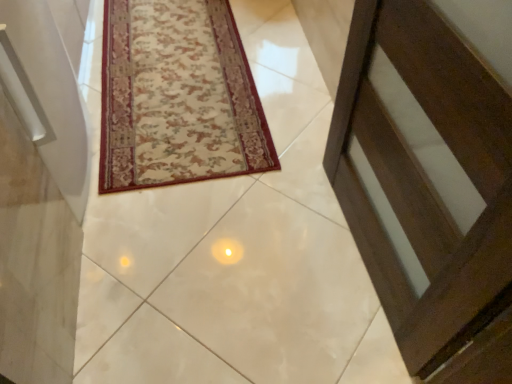
Question: Is white glossy tile at center surrounding beige floral rug at center?

Choices:
 (A) yes
 (B) no

Answer: (A)

Question: Is white glossy tile at center far away from beige floral rug at center?

Choices:
 (A) yes
 (B) no

Answer: (B)

Question: Is white glossy tile at center shorter than beige floral rug at center?

Choices:
 (A) yes
 (B) no

Answer: (B)

Question: Is white glossy tile at center thinner than beige floral rug at center?

Choices:
 (A) yes
 (B) no

Answer: (B)

Question: Is white glossy tile at center closer to the viewer compared to beige floral rug at center?

Choices:
 (A) yes
 (B) no

Answer: (A)

Question: From the image's perspective, is white glossy tile at center on beige floral rug at center?

Choices:
 (A) yes
 (B) no

Answer: (B)

Question: From the image's perspective, would you say beige floral rug at center is shown under white glossy tile at center?

Choices:
 (A) no
 (B) yes

Answer: (A)

Question: Is beige floral rug at center to the right of white glossy tile at center from the viewer's perspective?

Choices:
 (A) no
 (B) yes

Answer: (A)

Question: Would you say beige floral rug at center is outside white glossy tile at center?

Choices:
 (A) yes
 (B) no

Answer: (B)

Question: From a real-world perspective, is beige floral rug at center positioned over white glossy tile at center based on gravity?

Choices:
 (A) no
 (B) yes

Answer: (B)

Question: Is beige floral rug at center shorter than white glossy tile at center?

Choices:
 (A) yes
 (B) no

Answer: (A)

Question: From a real-world perspective, is beige floral rug at center physically below white glossy tile at center?

Choices:
 (A) no
 (B) yes

Answer: (A)

Question: Looking at the image, does white glossy tile at center seem bigger or smaller compared to beige floral rug at center?

Choices:
 (A) small
 (B) big

Answer: (B)